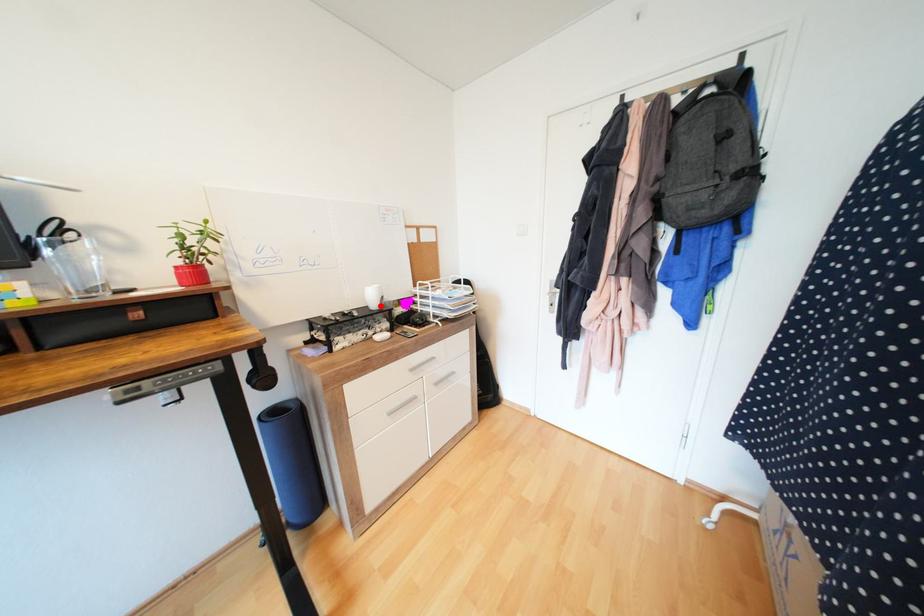
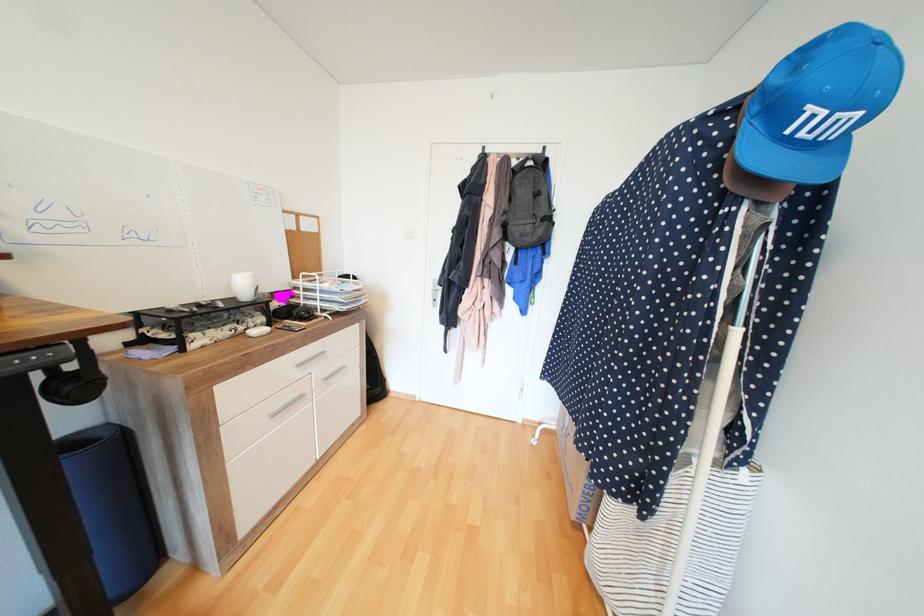
In the second image, find the point that corresponds to the highlighted location in the first image.

(251, 296)